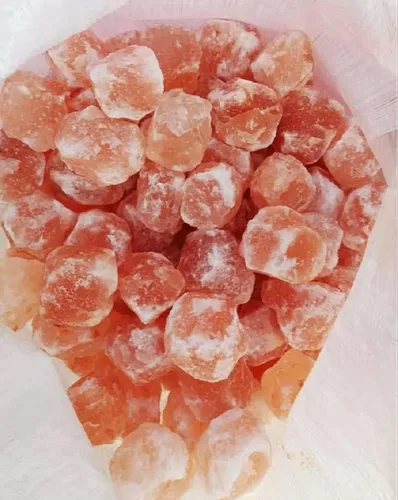
The image size is (398, 500). I want to click on sheer fabric, so click(39, 431), click(356, 39), click(370, 425), click(46, 12).